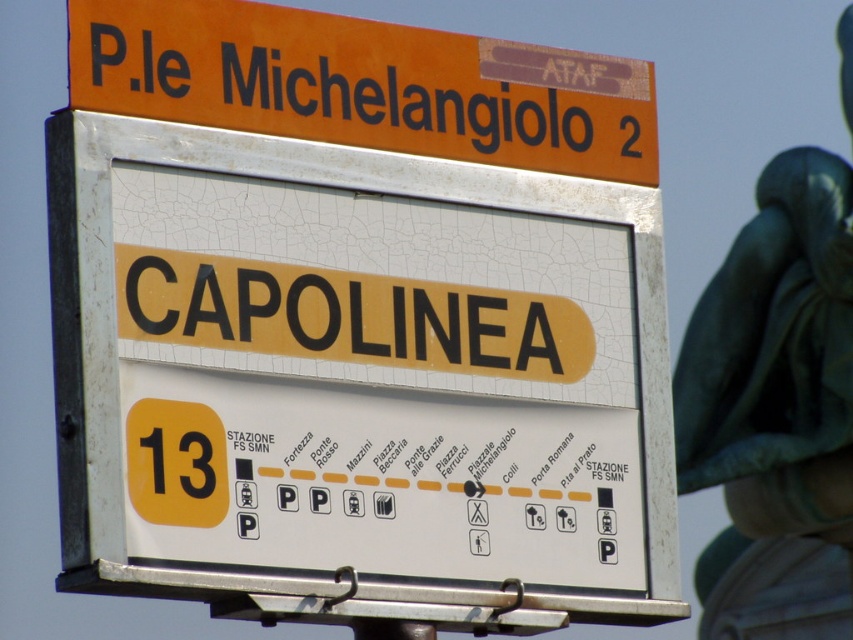
Consider the image. You are a bus driver checking the route information on the signboard. You see the white cracked plastic sign at center and the orange matte sign at upper center. Which one is taller?

The white cracked plastic sign at center is taller than the orange matte sign at upper center.